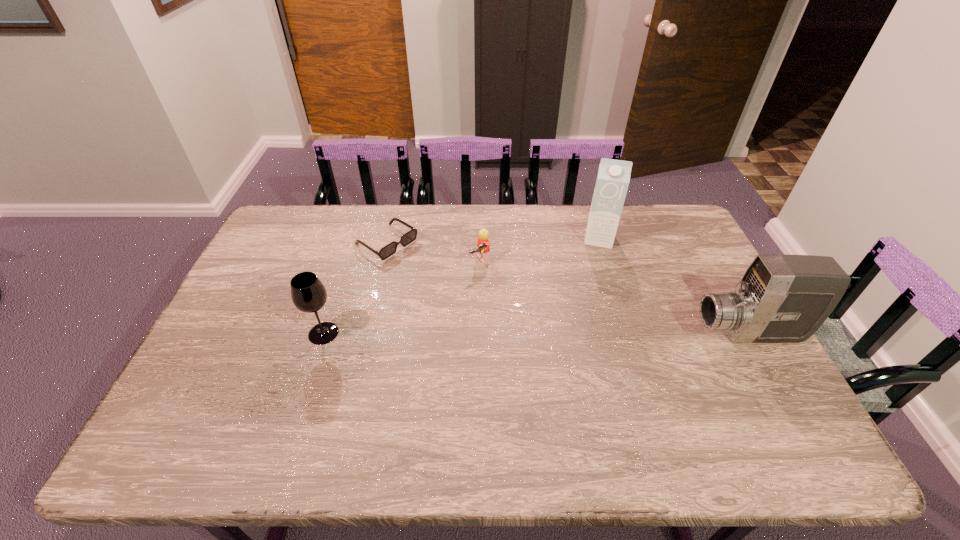
You are a GUI agent. You are given a task and a screenshot of the screen. Output one action in this format:
    pyautogui.click(x=<x>, y=<y>)
    Task: Click on the third tallest object
    The height and width of the screenshot is (540, 960).
    Given the screenshot: What is the action you would take?
    pyautogui.click(x=309, y=295)

The width and height of the screenshot is (960, 540). In order to click on the rightmost object in this screenshot , I will do `click(781, 298)`.

Where is `the fourth shortest object`? The image size is (960, 540). the fourth shortest object is located at coordinates point(781,298).

Locate an element on the screen. sunglasses is located at coordinates (390, 249).

Where is `the second shortest object`? This screenshot has height=540, width=960. the second shortest object is located at coordinates (483, 244).

Locate an element on the screen. This screenshot has height=540, width=960. the third object from right to left is located at coordinates [483, 244].

The width and height of the screenshot is (960, 540). What are the coordinates of `the second object from right to left` in the screenshot? It's located at (613, 177).

Image resolution: width=960 pixels, height=540 pixels. Identify the location of carton. (613, 177).

The height and width of the screenshot is (540, 960). I want to click on free location located 0.200m on the back of the wineglass, so click(343, 274).

Locate an element on the screen. Image resolution: width=960 pixels, height=540 pixels. free spot located 0.390m at the front of the camcorder, highlighting the lens is located at coordinates (555, 334).